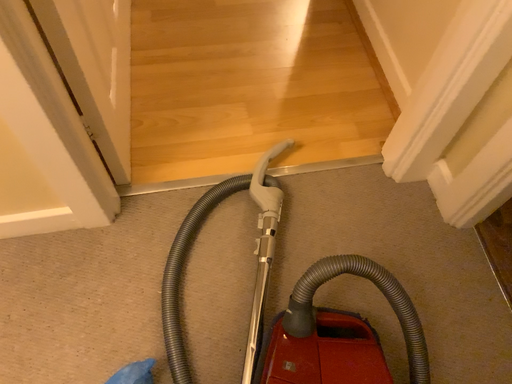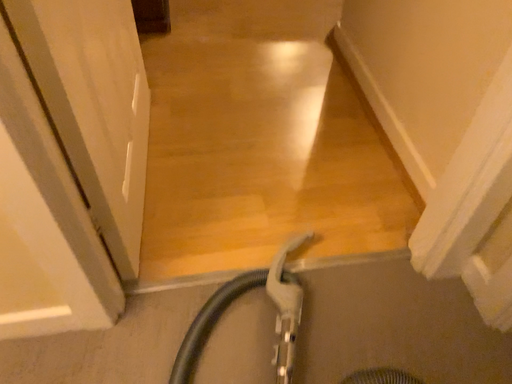
Question: Which way did the camera rotate in the video?

Choices:
 (A) rotated downward
 (B) rotated upward

Answer: (B)